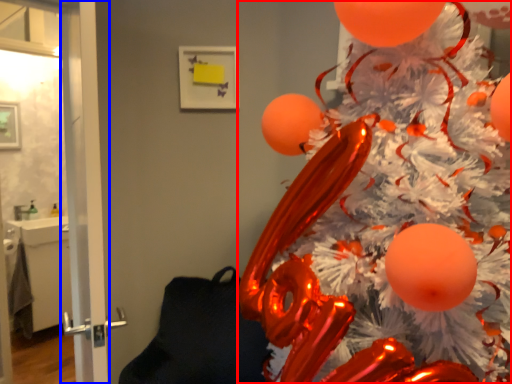
Question: Which object appears closest to the camera in this image, christmas tree (highlighted by a red box) or screen door (highlighted by a blue box)?

Choices:
 (A) christmas tree
 (B) screen door

Answer: (A)